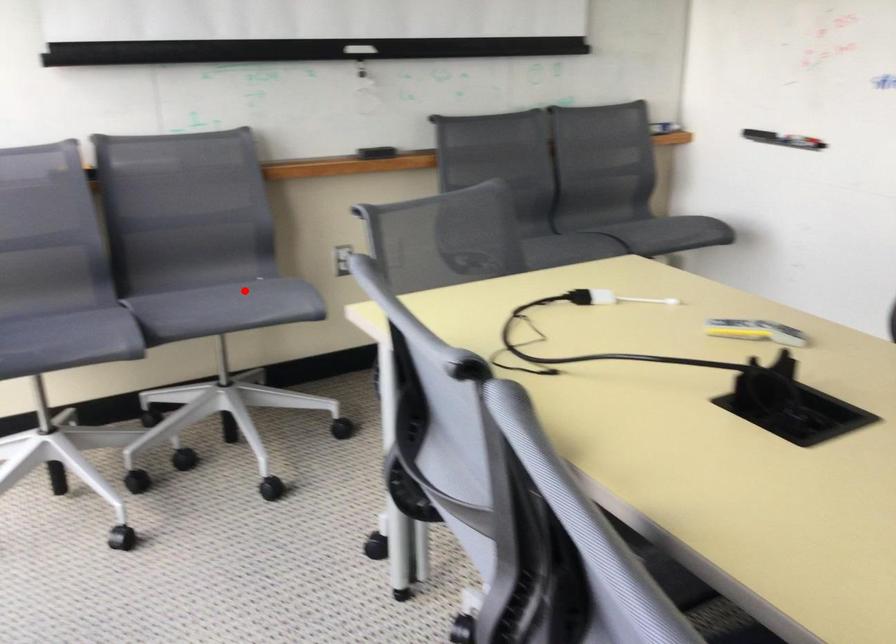
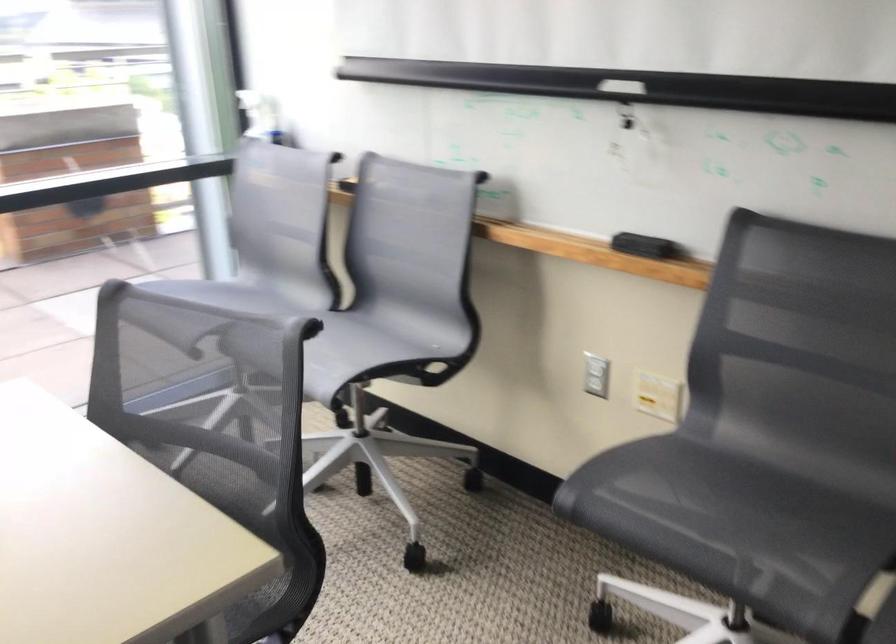
In the second image, find the point that corresponds to the highlighted location in the first image.

(348, 351)